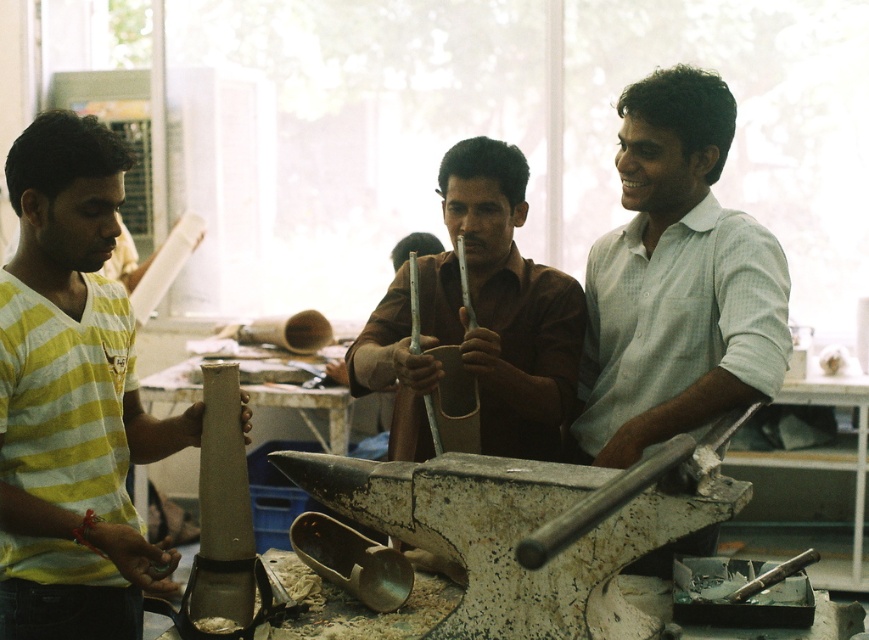
Question: Considering the real-world distances, which object is farthest from the brown matte cup at center?

Choices:
 (A) yellow striped shirt at left
 (B) white checkered shirt at center

Answer: (A)

Question: Can you confirm if yellow striped shirt at left is positioned to the right of white checkered shirt at center?

Choices:
 (A) no
 (B) yes

Answer: (A)

Question: Among these points, which one is nearest to the camera?

Choices:
 (A) (184, 429)
 (B) (724, 340)

Answer: (A)

Question: Which object is positioned farthest from the yellow striped shirt at left?

Choices:
 (A) brown matte cup at center
 (B) white checkered shirt at center

Answer: (B)

Question: Can you confirm if white checkered shirt at center is smaller than brown matte cup at center?

Choices:
 (A) yes
 (B) no

Answer: (B)

Question: Observing the image, what is the correct spatial positioning of yellow striped shirt at left in reference to white checkered shirt at center?

Choices:
 (A) above
 (B) below

Answer: (B)